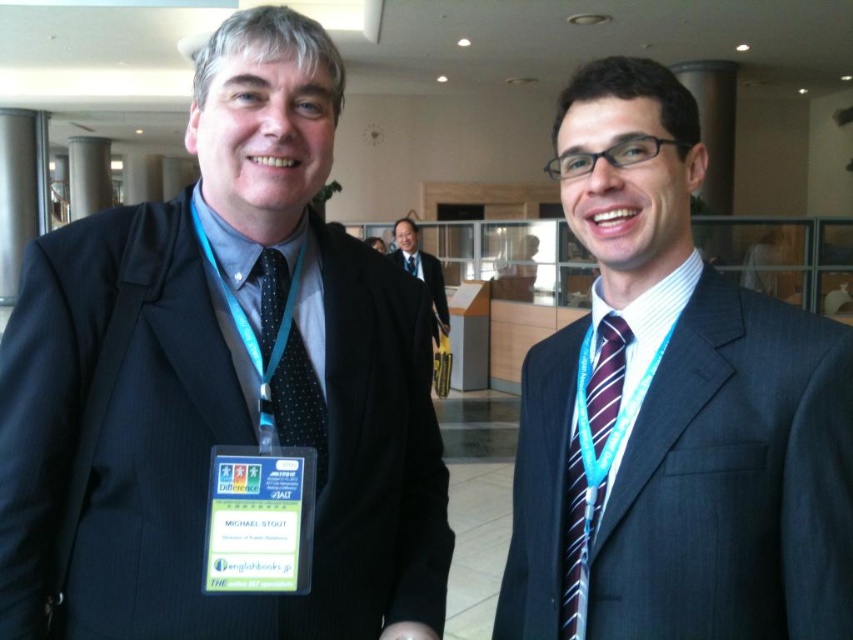
Question: Does matte black suit at left appear under dark blue suit at center?

Choices:
 (A) no
 (B) yes

Answer: (A)

Question: Is striped silk tie at right bigger than black dotted tie at center?

Choices:
 (A) yes
 (B) no

Answer: (B)

Question: Does dark blue suit at center appear over black dotted tie at center?

Choices:
 (A) yes
 (B) no

Answer: (B)

Question: Which of the following is the closest to the observer?

Choices:
 (A) (415, 266)
 (B) (299, 344)
 (C) (274, 339)
 (D) (749, 572)

Answer: (D)

Question: Which of the following is the farthest from the observer?

Choices:
 (A) (608, 378)
 (B) (581, 632)
 (C) (440, 330)
 (D) (416, 269)

Answer: (D)

Question: Which point is closer to the camera?

Choices:
 (A) (405, 262)
 (B) (286, 269)

Answer: (B)